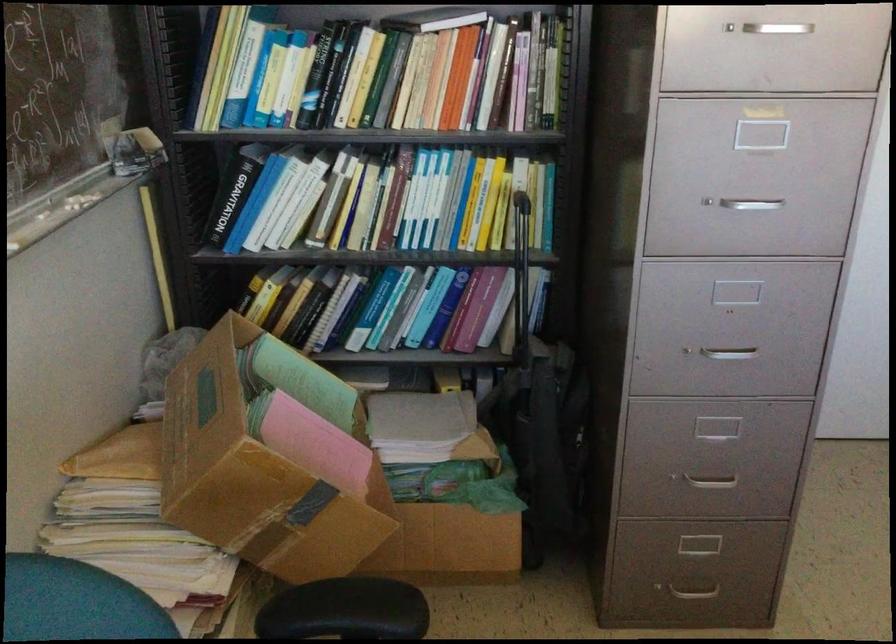
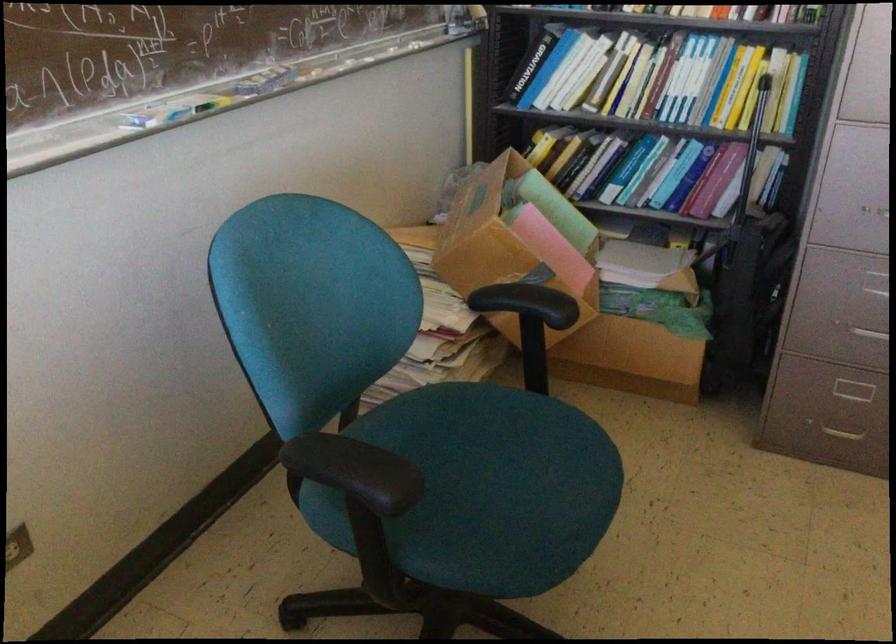
The point at (x=707, y=477) is marked in the first image. Where is the corresponding point in the second image?

(869, 330)